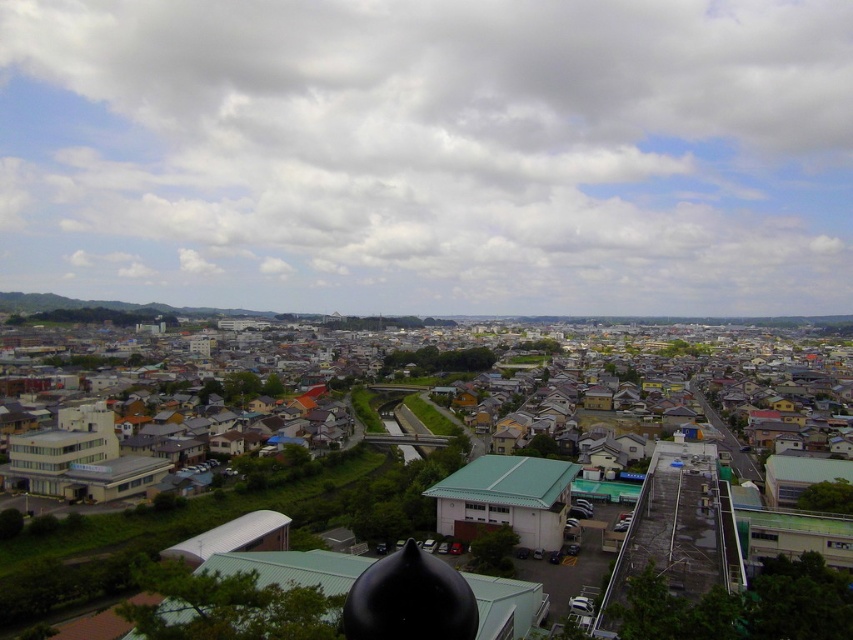
You are standing at the black spherical object in the foreground of the urban scene. You want to take a photo that includes both the point at coordinates (291, 140) and the point at (508, 492). Which point should you focus on first to ensure both are in focus?

You should focus on the point at (291, 140) first because it is closer to you than the point at (508, 492). This ensures that both points will be within the camera lens focus range.

In the scene shown: You are an architect designing a new rooftop garden for the matte gray building at center. Considering the white fluffy cloud at upper center, which direction should the garden face to ensure it gets maximum sunlight without obstruction?

The white fluffy cloud at upper center is located above the matte gray building at center, so the garden should face away from the cloud to avoid shading. A southern orientation might be ideal to maximize sunlight in the northern hemisphere, but adjustments may be needed based on local climate and cloud patterns.